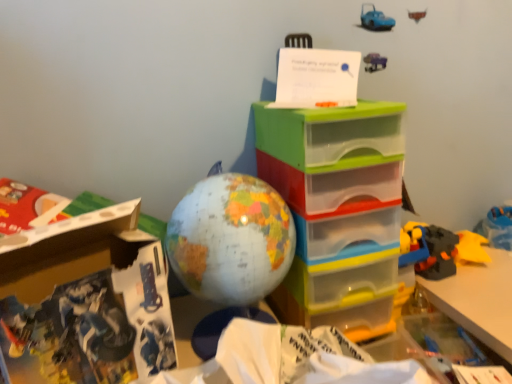
Question: Is white cardboard box at lower left wider than map-patterned globe at center?

Choices:
 (A) yes
 (B) no

Answer: (B)

Question: Is white cardboard box at lower left shorter than map-patterned globe at center?

Choices:
 (A) yes
 (B) no

Answer: (B)

Question: Is white cardboard box at lower left smaller than map-patterned globe at center?

Choices:
 (A) no
 (B) yes

Answer: (B)

Question: Considering the relative sizes of white cardboard box at lower left and map-patterned globe at center in the image provided, is white cardboard box at lower left taller than map-patterned globe at center?

Choices:
 (A) yes
 (B) no

Answer: (A)

Question: Is white cardboard box at lower left to the left of map-patterned globe at center from the viewer's perspective?

Choices:
 (A) no
 (B) yes

Answer: (B)

Question: Considering the relative sizes of white cardboard box at lower left and map-patterned globe at center in the image provided, is white cardboard box at lower left bigger than map-patterned globe at center?

Choices:
 (A) no
 (B) yes

Answer: (A)

Question: From a real-world perspective, does map-patterned globe at center sit lower than white cardboard box at lower left?

Choices:
 (A) yes
 (B) no

Answer: (B)

Question: Can you confirm if map-patterned globe at center is taller than white cardboard box at lower left?

Choices:
 (A) yes
 (B) no

Answer: (B)

Question: Is map-patterned globe at center next to white cardboard box at lower left and touching it?

Choices:
 (A) no
 (B) yes

Answer: (A)

Question: Is white cardboard box at lower left surrounded by map-patterned globe at center?

Choices:
 (A) yes
 (B) no

Answer: (B)

Question: Is map-patterned globe at center far away from white cardboard box at lower left?

Choices:
 (A) no
 (B) yes

Answer: (A)

Question: From the image's perspective, is map-patterned globe at center below white cardboard box at lower left?

Choices:
 (A) yes
 (B) no

Answer: (B)

Question: Can you confirm if translucent plastic drawers at center is thinner than map-patterned globe at center?

Choices:
 (A) yes
 (B) no

Answer: (B)